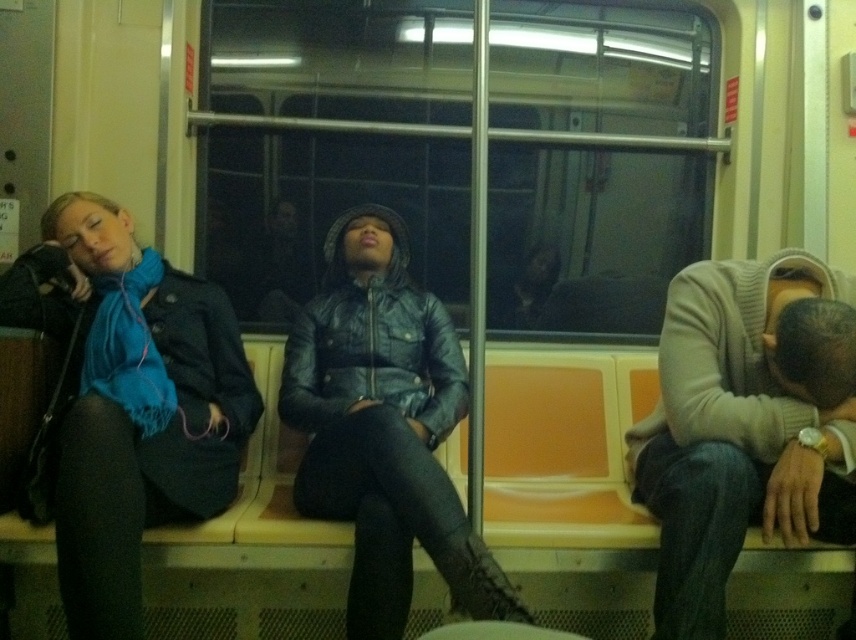
Question: Is light gray sweater at right above leather jacket at center?

Choices:
 (A) yes
 (B) no

Answer: (B)

Question: Which point is farther to the camera?

Choices:
 (A) click(x=708, y=424)
 (B) click(x=414, y=332)

Answer: (B)

Question: Is matte black coat at left below leather jacket at center?

Choices:
 (A) no
 (B) yes

Answer: (A)

Question: Which is nearer to the light gray sweater at right?

Choices:
 (A) matte black coat at left
 (B) leather jacket at center

Answer: (B)

Question: Which object is closer to the camera taking this photo?

Choices:
 (A) leather jacket at center
 (B) matte black coat at left
 (C) light gray sweater at right

Answer: (B)

Question: Is light gray sweater at right positioned in front of leather jacket at center?

Choices:
 (A) no
 (B) yes

Answer: (A)